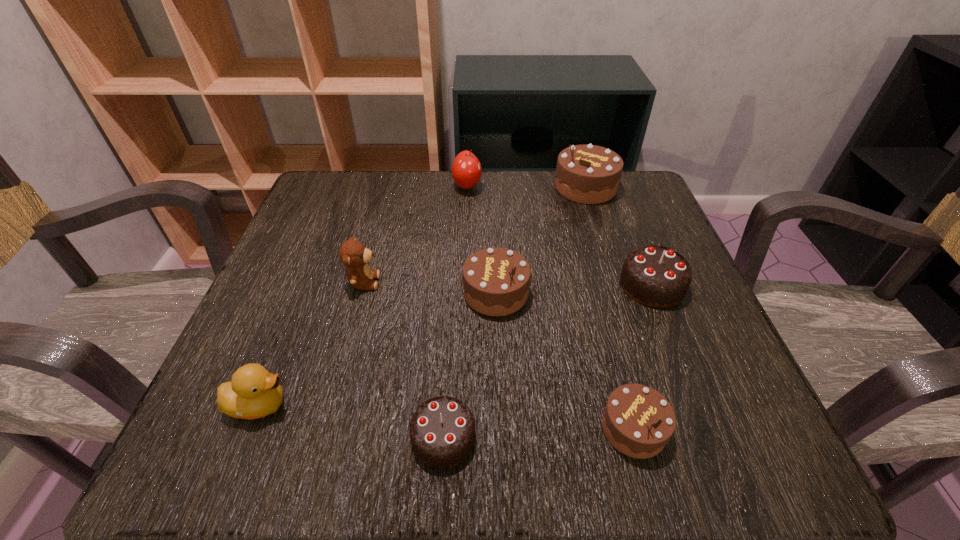
I want to click on vacant space that is in between the farther chocolate chocolate cake and the second nearest brown chocolate cake, so click(x=574, y=289).

Find the location of `vacant area that lies between the right chocolate chocolate cake and the smallest brown chocolate cake`. vacant area that lies between the right chocolate chocolate cake and the smallest brown chocolate cake is located at coordinates (642, 356).

Identify which object is located as the fourth nearest to the bigger chocolate chocolate cake. Please provide its 2D coordinates. Your answer should be formatted as a tuple, i.e. [(x, y)], where the tuple contains the x and y coordinates of a point satisfying the conditions above.

[(442, 431)]

The width and height of the screenshot is (960, 540). I want to click on object that stands as the fifth closest to the nearest brown chocolate cake, so click(x=253, y=392).

At what (x,y) coordinates should I click in order to perform the action: click on chocolate cake that is the fifth closest to the apple. Please return your answer as a coordinate pair (x, y). Looking at the image, I should click on (638, 421).

This screenshot has width=960, height=540. Find the location of `the third closest chocolate cake to the nearer chocolate chocolate cake`. the third closest chocolate cake to the nearer chocolate chocolate cake is located at coordinates (655, 276).

Locate which brown chocolate cake ranks second in proximity to the bigger chocolate chocolate cake. Please provide its 2D coordinates. Your answer should be formatted as a tuple, i.e. [(x, y)], where the tuple contains the x and y coordinates of a point satisfying the conditions above.

[(638, 421)]

At what (x,y) coordinates should I click in order to perform the action: click on brown chocolate cake that stands as the closest to the apple. Please return your answer as a coordinate pair (x, y). Looking at the image, I should click on (588, 174).

Locate an element on the screen. vacant area that satisfies the following two spatial constraints: 1. facing forward on the leftmost object; 2. on the back side of the left chocolate chocolate cake is located at coordinates (246, 437).

This screenshot has width=960, height=540. In order to click on free space in the image that satisfies the following two spatial constraints: 1. on the front side of the farthest brown chocolate cake; 2. facing forward on the leftmost object in this screenshot , I will do `click(653, 404)`.